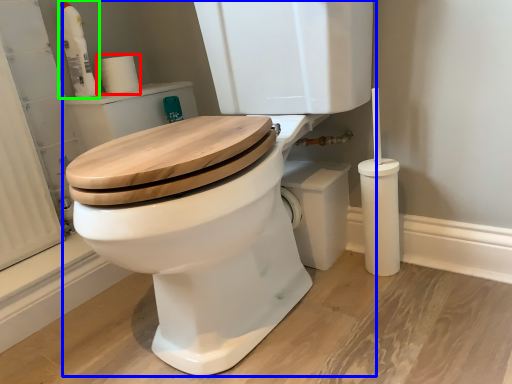
Question: Which object is the closest to the toilet paper (highlighted by a red box)? Choose among these: toilet (highlighted by a blue box) or cleaning product (highlighted by a green box).

Choices:
 (A) toilet
 (B) cleaning product

Answer: (B)